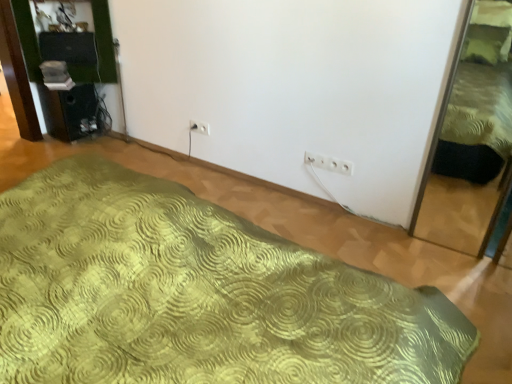
Based on the photo, in order to face green textured bed at center, which appears as the second bed when viewed from the right, should I rotate leftwards or rightwards?

Turn left approximately 16.053 degrees to face it.

Locate an element on the screen. Image resolution: width=512 pixels, height=384 pixels. white plastic electric outlet at center, the 2th electric outlet positioned from the right is located at coordinates (199, 127).

What do you see at coordinates (199, 127) in the screenshot? I see `white plastic electric outlet at center, which is the first electric outlet in back-to-front order` at bounding box center [199, 127].

At what (x,y) coordinates should I click in order to perform the action: click on white plastic electric outlet at center, which is counted as the 2th electric outlet, starting from the back. Please return your answer as a coordinate pair (x, y). The height and width of the screenshot is (384, 512). Looking at the image, I should click on (329, 163).

The width and height of the screenshot is (512, 384). Identify the location of green textured bed at center, the first bed in the left-to-right sequence. (196, 294).

Could green textured bed at right, the first bed from the right, be considered to be inside white plastic electric outlet at center, placed as the second electric outlet when sorted from front to back?

No.

Considering the sizes of white plastic electric outlet at center, the 2th electric outlet positioned from the right, and green textured bed at right, the first bed from the right, in the image, is white plastic electric outlet at center, the 2th electric outlet positioned from the right, taller or shorter than green textured bed at right, the first bed from the right,?

white plastic electric outlet at center, the 2th electric outlet positioned from the right, is shorter than green textured bed at right, the first bed from the right.

Does white plastic electric outlet at center, the 2th electric outlet positioned from the right, have a smaller size compared to green textured bed at right, the first bed from the right?

Yes.

Which object is wider, white plastic electric outlet at center, the second electric outlet when ordered from bottom to top, or green textured bed at right, which is counted as the 2th bed, starting from the left?

Wider between the two is green textured bed at right, which is counted as the 2th bed, starting from the left.

In order to click on electric outlet below the white plastic electric outlet at center, which ranks as the first electric outlet in top-to-bottom order (from the image's perspective) in this screenshot , I will do `click(329, 163)`.

Is white plastic electric outlet at center, which is the first electric outlet in back-to-front order, bigger than white plastic electric outlet at center, which is counted as the 1th electric outlet, starting from the right?

Incorrect, white plastic electric outlet at center, which is the first electric outlet in back-to-front order, is not larger than white plastic electric outlet at center, which is counted as the 1th electric outlet, starting from the right.

Is point (201, 130) closer or farther from the camera than point (316, 164)?

Clearly, point (201, 130) is more distant from the camera than point (316, 164).

Identify the location of electric outlet on the right of the green textured bed at center, which appears as the second bed when viewed from the right. The image size is (512, 384). pos(329,163).

Is green textured bed at center, the first bed in the left-to-right sequence, completely or partially inside white plastic electric outlet at center, acting as the 1th electric outlet starting from the front?

No, green textured bed at center, the first bed in the left-to-right sequence, is not inside white plastic electric outlet at center, acting as the 1th electric outlet starting from the front.

From the image's perspective, is white plastic electric outlet at center, placed as the 2th electric outlet when sorted from top to bottom, positioned above or below green textured bed at center, which appears as the second bed when viewed from the right?

white plastic electric outlet at center, placed as the 2th electric outlet when sorted from top to bottom, is situated higher than green textured bed at center, which appears as the second bed when viewed from the right, in the image.

You are a GUI agent. You are given a task and a screenshot of the screen. Output one action in this format:
    pyautogui.click(x=<x>, y=<y>)
    Task: Click on the 1st electric outlet below the green textured bed at right, which is counted as the 2th bed, starting from the left (from a real-world perspective)
    Image resolution: width=512 pixels, height=384 pixels.
    Given the screenshot: What is the action you would take?
    pyautogui.click(x=329, y=163)

Which object is closer to the camera, green textured bed at right, the first bed from the right, or white plastic electric outlet at center, placed as the 2th electric outlet when sorted from top to bottom?

green textured bed at right, the first bed from the right, is closer to the camera.

Does point (462, 170) come closer to viewer compared to point (321, 164)?

No, (462, 170) is further to viewer.

Looking at this image, considering the positions of objects green textured bed at right, which is counted as the 2th bed, starting from the left, and white plastic electric outlet at center, which is counted as the first electric outlet, starting from the bottom, in the image provided, who is more to the right, green textured bed at right, which is counted as the 2th bed, starting from the left, or white plastic electric outlet at center, which is counted as the first electric outlet, starting from the bottom,?

green textured bed at right, which is counted as the 2th bed, starting from the left.

Based on the photo, how many degrees apart are the facing directions of green textured bed at center, the first bed in the left-to-right sequence, and white plastic electric outlet at center, which is counted as the first electric outlet, starting from the bottom?

There is a 178-degree angle between the facing directions of green textured bed at center, the first bed in the left-to-right sequence, and white plastic electric outlet at center, which is counted as the first electric outlet, starting from the bottom.

Is green textured bed at center, which appears as the second bed when viewed from the right, not inside white plastic electric outlet at center, acting as the 1th electric outlet starting from the front?

Yes.

Which object is further away from the camera, green textured bed at center, the first bed in the left-to-right sequence, or white plastic electric outlet at center, which appears as the second electric outlet when viewed from the left?

Positioned behind is white plastic electric outlet at center, which appears as the second electric outlet when viewed from the left.

Does green textured bed at center, which appears as the second bed when viewed from the right, turn towards white plastic electric outlet at center, which is counted as the 1th electric outlet, starting from the right?

Yes, green textured bed at center, which appears as the second bed when viewed from the right, faces towards white plastic electric outlet at center, which is counted as the 1th electric outlet, starting from the right.

Can you confirm if green textured bed at right, the first bed from the right, is bigger than white plastic electric outlet at center, placed as the second electric outlet when sorted from front to back?

Correct, green textured bed at right, the first bed from the right, is larger in size than white plastic electric outlet at center, placed as the second electric outlet when sorted from front to back.

Which electric outlet is the 2nd one when counting from the back of the green textured bed at right, the first bed from the right? Please provide its 2D coordinates.

[(199, 127)]

Which is closer, (465, 70) or (192, 120)?

Point (465, 70) appears to be farther away from the viewer than point (192, 120).

In the scene shown: Which object is positioned more to the left, green textured bed at right, the first bed from the right, or white plastic electric outlet at center, which is the first electric outlet in back-to-front order?

From the viewer's perspective, white plastic electric outlet at center, which is the first electric outlet in back-to-front order, appears more on the left side.

Is white plastic electric outlet at center, placed as the 2th electric outlet when sorted from top to bottom, taller than white plastic electric outlet at center, placed as the second electric outlet when sorted from front to back?

Indeed, white plastic electric outlet at center, placed as the 2th electric outlet when sorted from top to bottom, has a greater height compared to white plastic electric outlet at center, placed as the second electric outlet when sorted from front to back.

Is white plastic electric outlet at center, which is counted as the 1th electric outlet, starting from the right, facing towards white plastic electric outlet at center, the second electric outlet when ordered from bottom to top?

No, white plastic electric outlet at center, which is counted as the 1th electric outlet, starting from the right, is not oriented towards white plastic electric outlet at center, the second electric outlet when ordered from bottom to top.

Who is more distant, white plastic electric outlet at center, which is counted as the 1th electric outlet, starting from the right, or white plastic electric outlet at center, the 2th electric outlet positioned from the right?

white plastic electric outlet at center, the 2th electric outlet positioned from the right, is behind.

How different are the orientations of white plastic electric outlet at center, which is counted as the first electric outlet, starting from the bottom, and white plastic electric outlet at center, placed as the second electric outlet when sorted from front to back, in degrees?

There is a 0.662-degree angle between the facing directions of white plastic electric outlet at center, which is counted as the first electric outlet, starting from the bottom, and white plastic electric outlet at center, placed as the second electric outlet when sorted from front to back.

Locate an element on the screen. The width and height of the screenshot is (512, 384). electric outlet that is the 2nd one below the green textured bed at right, which is counted as the 2th bed, starting from the left (from a real-world perspective) is located at coordinates (199, 127).

Find the location of a particular element. This screenshot has height=384, width=512. electric outlet in front of the white plastic electric outlet at center, which ranks as the first electric outlet in top-to-bottom order is located at coordinates (329, 163).

Which object lies nearer to the anchor point green textured bed at center, which appears as the second bed when viewed from the right, white plastic electric outlet at center, placed as the 2th electric outlet when sorted from top to bottom, or green textured bed at right, which is counted as the 2th bed, starting from the left?

The object closer to green textured bed at center, which appears as the second bed when viewed from the right, is white plastic electric outlet at center, placed as the 2th electric outlet when sorted from top to bottom.

From the image, which object appears to be nearer to green textured bed at right, the first bed from the right, white plastic electric outlet at center, placed as the 2th electric outlet when sorted from top to bottom, or white plastic electric outlet at center, which is the first electric outlet in back-to-front order?

Among the two, white plastic electric outlet at center, placed as the 2th electric outlet when sorted from top to bottom, is located nearer to green textured bed at right, the first bed from the right.

Which object lies further to the anchor point green textured bed at right, the first bed from the right, white plastic electric outlet at center, the 2th electric outlet positioned from the right, or white plastic electric outlet at center, which is counted as the 2th electric outlet, starting from the back?

white plastic electric outlet at center, the 2th electric outlet positioned from the right, is further to green textured bed at right, the first bed from the right.

Looking at the image, which one is located closer to white plastic electric outlet at center, which is counted as the 2th electric outlet, starting from the back, white plastic electric outlet at center, the 2th electric outlet positioned from the right, or green textured bed at center, the first bed in the left-to-right sequence?

white plastic electric outlet at center, the 2th electric outlet positioned from the right, is positioned closer to the anchor white plastic electric outlet at center, which is counted as the 2th electric outlet, starting from the back.

Considering their positions, is white plastic electric outlet at center, the 2th electric outlet positioned from the right, positioned closer to green textured bed at center, which appears as the second bed when viewed from the right, than white plastic electric outlet at center, which appears as the second electric outlet when viewed from the left?

white plastic electric outlet at center, which appears as the second electric outlet when viewed from the left.

Which object lies further to the anchor point white plastic electric outlet at center, which is the first electric outlet in back-to-front order, green textured bed at center, the first bed in the left-to-right sequence, or white plastic electric outlet at center, which is counted as the first electric outlet, starting from the bottom?

green textured bed at center, the first bed in the left-to-right sequence, is positioned further to the anchor white plastic electric outlet at center, which is the first electric outlet in back-to-front order.

Looking at the image, which one is located further to green textured bed at center, which appears as the second bed when viewed from the right, white plastic electric outlet at center, which appears as the second electric outlet when viewed from the left, or white plastic electric outlet at center, the second electric outlet when ordered from bottom to top?

The object further to green textured bed at center, which appears as the second bed when viewed from the right, is white plastic electric outlet at center, the second electric outlet when ordered from bottom to top.

Based on their spatial positions, is white plastic electric outlet at center, which is the first electric outlet in back-to-front order, or green textured bed at right, the first bed from the right, further from green textured bed at center, which appears as the second bed when viewed from the right?

The object further to green textured bed at center, which appears as the second bed when viewed from the right, is white plastic electric outlet at center, which is the first electric outlet in back-to-front order.

Where is `bed between green textured bed at center, which appears as the second bed when viewed from the right, and white plastic electric outlet at center, placed as the second electric outlet when sorted from front to back, along the z-axis`? The height and width of the screenshot is (384, 512). bed between green textured bed at center, which appears as the second bed when viewed from the right, and white plastic electric outlet at center, placed as the second electric outlet when sorted from front to back, along the z-axis is located at coordinates tap(473, 141).

Find the location of a particular element. This screenshot has width=512, height=384. electric outlet located between green textured bed at center, which appears as the second bed when viewed from the right, and white plastic electric outlet at center, which ranks as the first electric outlet in top-to-bottom order, in the depth direction is located at coordinates (329, 163).

Identify the location of bed between green textured bed at center, the first bed in the left-to-right sequence, and white plastic electric outlet at center, which is counted as the 1th electric outlet, starting from the right, from front to back. The image size is (512, 384). [473, 141].

At what (x,y) coordinates should I click in order to perform the action: click on electric outlet between white plastic electric outlet at center, placed as the first electric outlet when sorted from left to right, and green textured bed at right, which is counted as the 2th bed, starting from the left, in the horizontal direction. Please return your answer as a coordinate pair (x, y). This screenshot has width=512, height=384. Looking at the image, I should click on (329, 163).